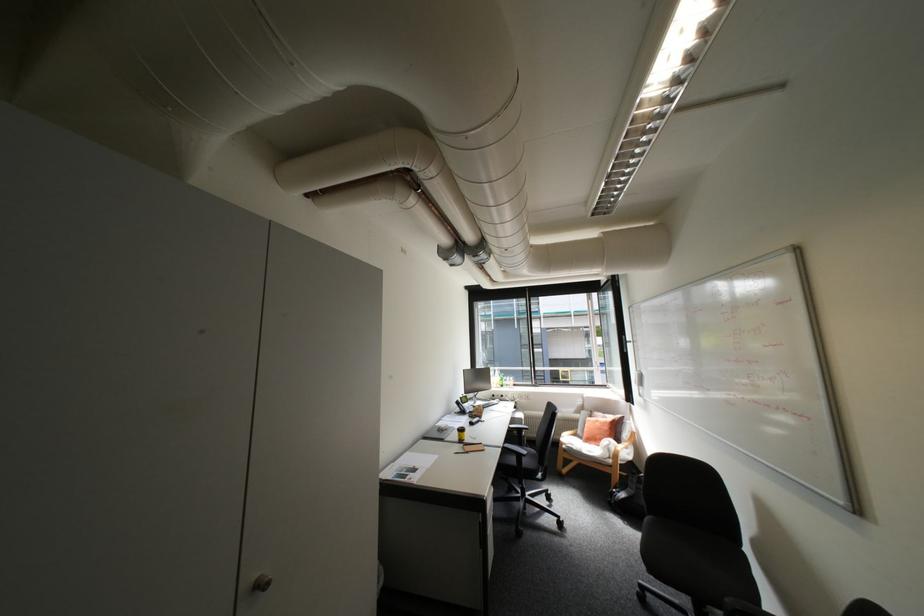
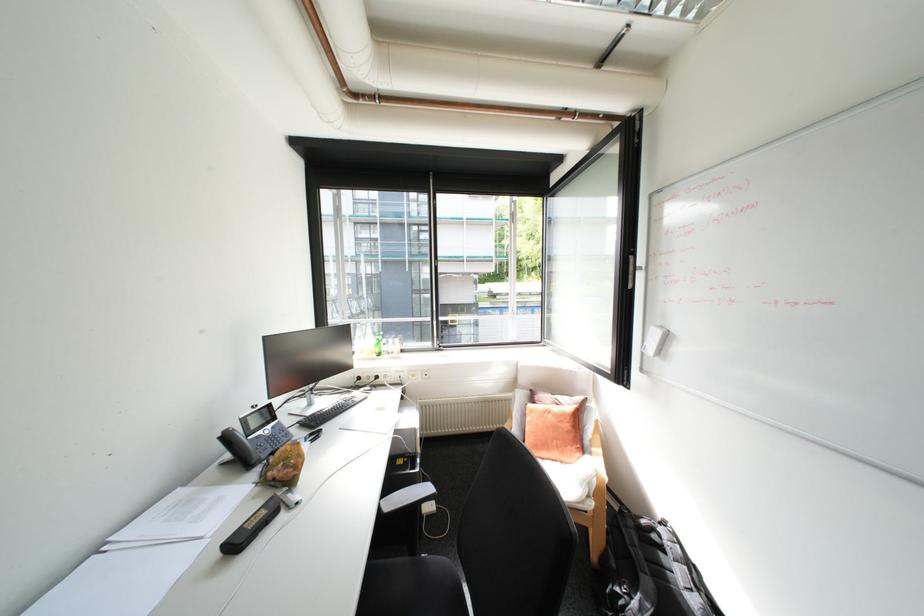
Where in the second image is the point corresponding to point (628, 493) from the first image?

(640, 598)